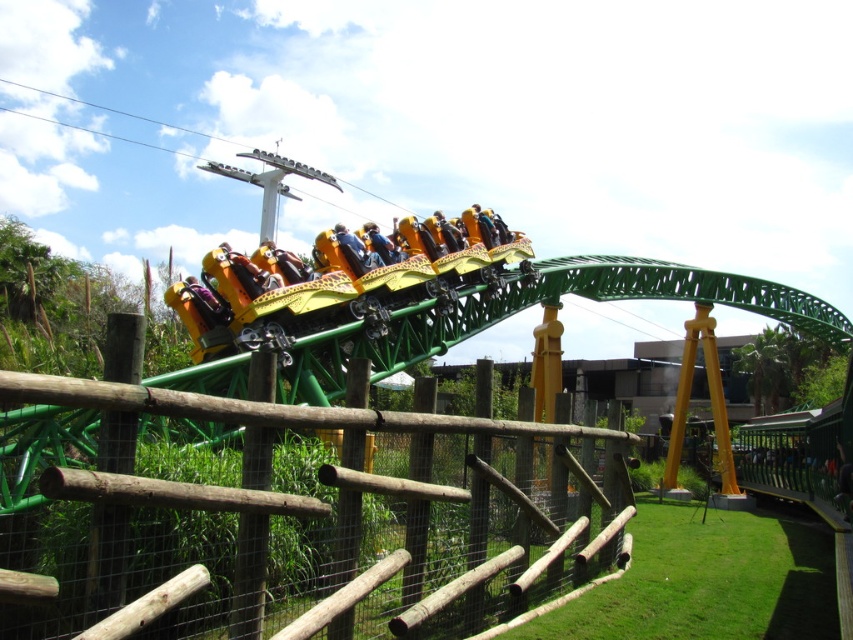
Who is shorter, wooden at center or yellow leopard print seats at center?

yellow leopard print seats at center is shorter.

Does wooden at center lie behind yellow leopard print seats at center?

No, it is in front of yellow leopard print seats at center.

Who is more distant from viewer, (563, 413) or (233, 332)?

Positioned behind is point (563, 413).

At what (x,y) coordinates should I click in order to perform the action: click on wooden at center. Please return your answer as a coordinate pair (x, y). Looking at the image, I should click on (299, 518).